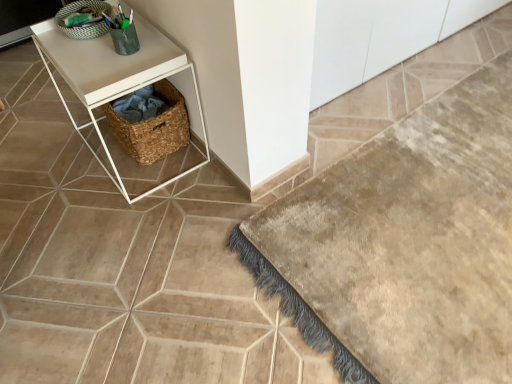
Question: Can woven brown basket at center, which is counted as the 1th basket, starting from the bottom, be found inside green woven basket at upper left, the 2th basket from the bottom?

Choices:
 (A) yes
 (B) no

Answer: (B)

Question: Could you tell me if green woven basket at upper left, the 2th basket from the bottom, is turned towards woven brown basket at center, which is counted as the 1th basket, starting from the bottom?

Choices:
 (A) no
 (B) yes

Answer: (A)

Question: Is green woven basket at upper left, the 2th basket from the bottom, positioned in front of woven brown basket at center, the second basket viewed from the top?

Choices:
 (A) no
 (B) yes

Answer: (B)

Question: Considering the relative sizes of green woven basket at upper left, positioned as the 1th basket in top-to-bottom order, and woven brown basket at center, which is counted as the 1th basket, starting from the bottom, in the image provided, is green woven basket at upper left, positioned as the 1th basket in top-to-bottom order, shorter than woven brown basket at center, which is counted as the 1th basket, starting from the bottom,?

Choices:
 (A) yes
 (B) no

Answer: (A)

Question: From the image's perspective, does green woven basket at upper left, positioned as the 1th basket in top-to-bottom order, appear lower than woven brown basket at center, the second basket viewed from the top?

Choices:
 (A) yes
 (B) no

Answer: (B)

Question: Is green woven basket at upper left, positioned as the 1th basket in top-to-bottom order, wider or thinner than white matte side table at upper left?

Choices:
 (A) thin
 (B) wide

Answer: (A)

Question: Is green woven basket at upper left, positioned as the 1th basket in top-to-bottom order, taller or shorter than white matte side table at upper left?

Choices:
 (A) short
 (B) tall

Answer: (A)

Question: Is green woven basket at upper left, positioned as the 1th basket in top-to-bottom order, inside the boundaries of white matte side table at upper left, or outside?

Choices:
 (A) inside
 (B) outside

Answer: (B)

Question: Is green woven basket at upper left, the 2th basket from the bottom, in front of or behind white matte side table at upper left in the image?

Choices:
 (A) behind
 (B) front

Answer: (A)

Question: Would you say woven brown basket at center, which is counted as the 1th basket, starting from the bottom, is to the left or to the right of woven basket at lower left in the picture?

Choices:
 (A) right
 (B) left

Answer: (A)

Question: Considering their positions, is woven brown basket at center, the second basket viewed from the top, located in front of or behind woven basket at lower left?

Choices:
 (A) behind
 (B) front

Answer: (B)

Question: Is woven brown basket at center, the second basket viewed from the top, situated inside woven basket at lower left or outside?

Choices:
 (A) outside
 (B) inside

Answer: (A)

Question: Is point (120, 130) closer or farther from the camera than point (134, 100)?

Choices:
 (A) closer
 (B) farther

Answer: (A)

Question: Is woven basket at lower left in front of or behind white matte side table at upper left in the image?

Choices:
 (A) behind
 (B) front

Answer: (A)

Question: From their relative heights in the image, would you say woven basket at lower left is taller or shorter than white matte side table at upper left?

Choices:
 (A) tall
 (B) short

Answer: (B)